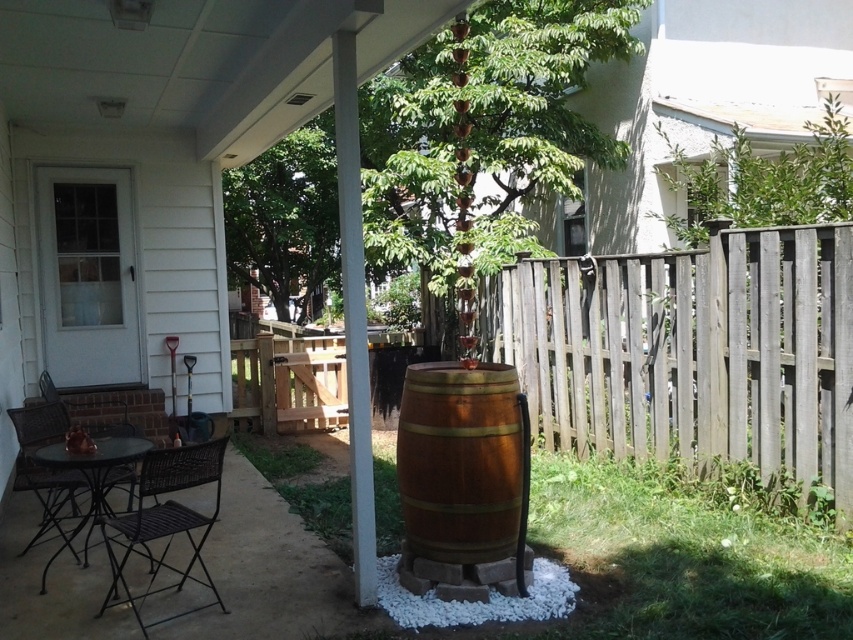
You are planning to install a new lighting fixture on the wooden barrel at center. To ensure it doesn not block the view of the weathered wood fence at right, where should you place the fixture?

The wooden barrel at center is behind the weathered wood fence at right, so placing the lighting fixture on the front side of the wooden barrel at center would keep the view of the weathered wood fence at right unobstructed.

You are planning to move a large potted plant that is as thick as the matte black table at lower left. Based on the scene, can the wooden barrel at center fit this plant without needing to replace the barrel?

The wooden barrel at center is thinner than the matte black table at lower left. Since the potted plant is as thick as the matte black table at lower left, the wooden barrel at center is not wide enough to accommodate the plant without needing to replace the barrel.

You are planning to place a new bench on the patio. The bench is 1.5 meters long. There is an open space between the weathered wood fence at right and the wooden barrel at center. Can the bench fit in that space?

The weathered wood fence at right is to the right of the wooden barrel at center, but the distance between them isn